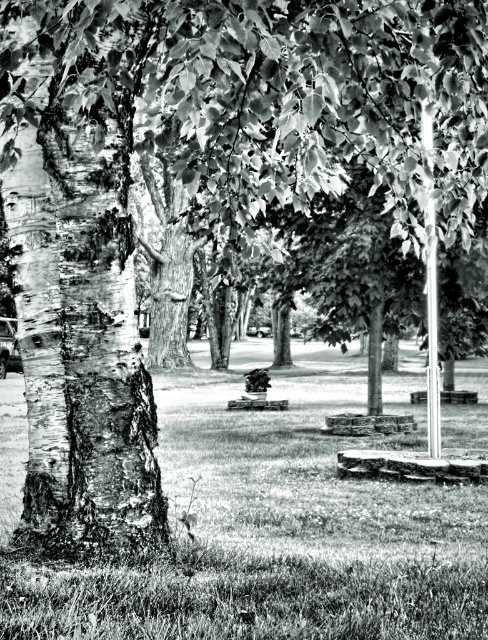
You are planning to place a new bench in the park. The bench requires a space larger than the metallic pole at upper right. Can the grassy lawn at center accommodate it?

The grassy lawn at center is bigger than the metallic pole at upper right, so yes, the bench can be placed there as it has sufficient space.

Based on the scene description, if you are standing facing the barky white tree trunk at left, which direction would the grassy lawn at center be located relative to you?

The grassy lawn at center is to the left of the barky white tree trunk at left, so if you are facing the tree trunk, the grassy lawn would be to your right side.

You are standing in the park and see the barky white tree trunk at left and the metallic pole at upper right. Which object is closer to you?

The barky white tree trunk at left is closer to you because it is in front of the metallic pole at upper right.